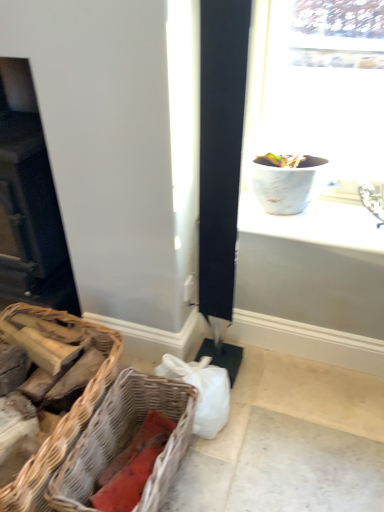
Question: Is matte black fireplace at left positioned with its back to brown wicker picnic basket at lower left, the first picnic basket when ordered from left to right?

Choices:
 (A) no
 (B) yes

Answer: (A)

Question: Is matte black fireplace at left wider than brown wicker picnic basket at lower left, the first picnic basket when ordered from left to right?

Choices:
 (A) no
 (B) yes

Answer: (A)

Question: Is there a large distance between matte black fireplace at left and brown wicker picnic basket at lower left, the 2th picnic basket when ordered from right to left?

Choices:
 (A) no
 (B) yes

Answer: (A)

Question: Is matte black fireplace at left placed right next to brown wicker picnic basket at lower left, the first picnic basket when ordered from left to right?

Choices:
 (A) yes
 (B) no

Answer: (B)

Question: Is matte black fireplace at left at the left side of brown wicker picnic basket at lower left, the first picnic basket when ordered from left to right?

Choices:
 (A) yes
 (B) no

Answer: (A)

Question: Is matte black fireplace at left at the right side of brown wicker picnic basket at lower left, the first picnic basket when ordered from left to right?

Choices:
 (A) yes
 (B) no

Answer: (B)

Question: From a real-world perspective, is matte black fireplace at left positioned under white textured vase at upper right based on gravity?

Choices:
 (A) yes
 (B) no

Answer: (A)

Question: Does matte black fireplace at left appear on the right side of white textured vase at upper right?

Choices:
 (A) no
 (B) yes

Answer: (A)

Question: Can you confirm if matte black fireplace at left is bigger than white textured vase at upper right?

Choices:
 (A) no
 (B) yes

Answer: (B)

Question: Is matte black fireplace at left directly adjacent to white textured vase at upper right?

Choices:
 (A) no
 (B) yes

Answer: (A)

Question: Does matte black fireplace at left have a lesser height compared to white textured vase at upper right?

Choices:
 (A) yes
 (B) no

Answer: (B)

Question: Does matte black fireplace at left have a smaller size compared to white textured vase at upper right?

Choices:
 (A) no
 (B) yes

Answer: (A)

Question: Is woven wood picnic basket at lower left, the first picnic basket viewed from the right, located within brown wicker picnic basket at lower left, the 2th picnic basket when ordered from right to left?

Choices:
 (A) no
 (B) yes

Answer: (A)